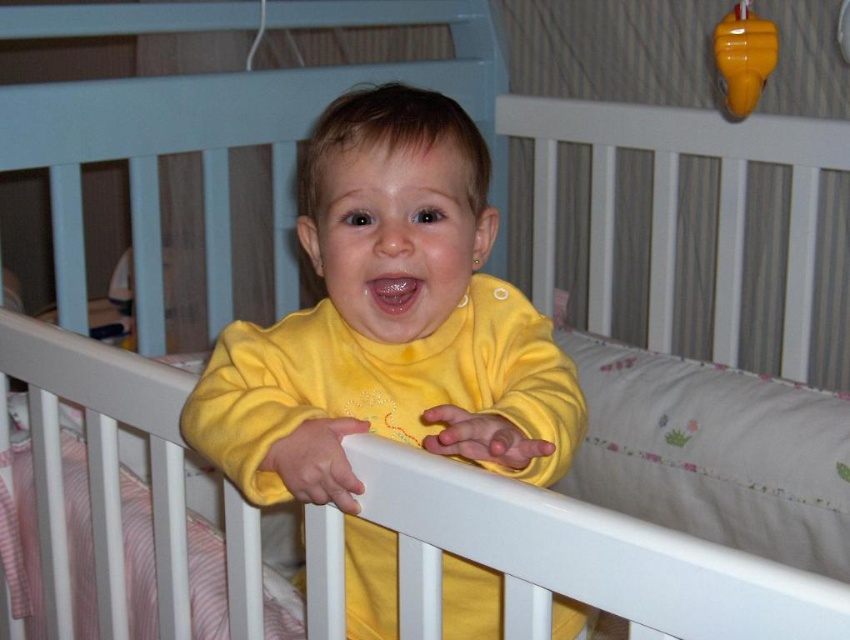
Question: Which of the following is the farthest from the observer?

Choices:
 (A) (544, 344)
 (B) (752, 83)

Answer: (B)

Question: Is yellow fleece baby at center to the right of shiny yellow rattle at upper right from the viewer's perspective?

Choices:
 (A) yes
 (B) no

Answer: (B)

Question: Is yellow fleece baby at center thinner than shiny yellow rattle at upper right?

Choices:
 (A) no
 (B) yes

Answer: (A)

Question: Does yellow fleece baby at center come in front of shiny yellow rattle at upper right?

Choices:
 (A) yes
 (B) no

Answer: (A)

Question: Which object appears closest to the camera in this image?

Choices:
 (A) shiny yellow rattle at upper right
 (B) yellow fleece baby at center

Answer: (B)

Question: Which of the following is the farthest from the observer?

Choices:
 (A) yellow fleece baby at center
 (B) shiny yellow rattle at upper right

Answer: (B)